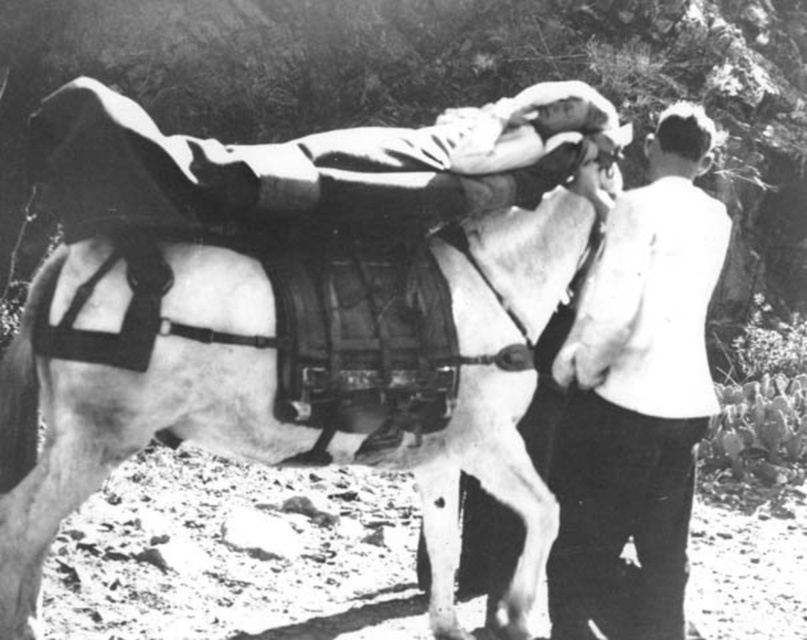
At what (x,y) coordinates should I click in order to perform the action: click on white matte horse at center. Please return your answer as a coordinate pair (x, y). Looking at the image, I should click on (111, 426).

Measure the distance between white matte horse at center and camera.

They are 3.19 meters apart.

The image size is (807, 640). Describe the element at coordinates (111, 426) in the screenshot. I see `white matte horse at center` at that location.

The image size is (807, 640). Find the location of `white matte horse at center`. white matte horse at center is located at coordinates (111, 426).